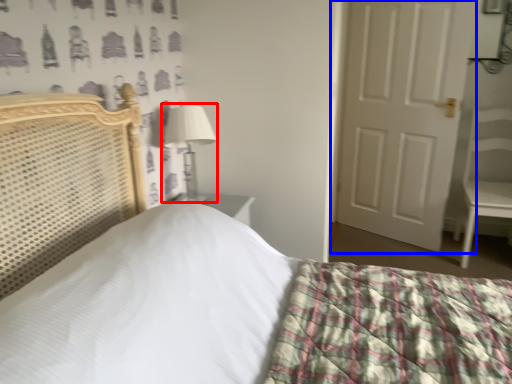
Question: Which object appears farthest to the camera in this image, table lamp (highlighted by a red box) or door (highlighted by a blue box)?

Choices:
 (A) table lamp
 (B) door

Answer: (B)